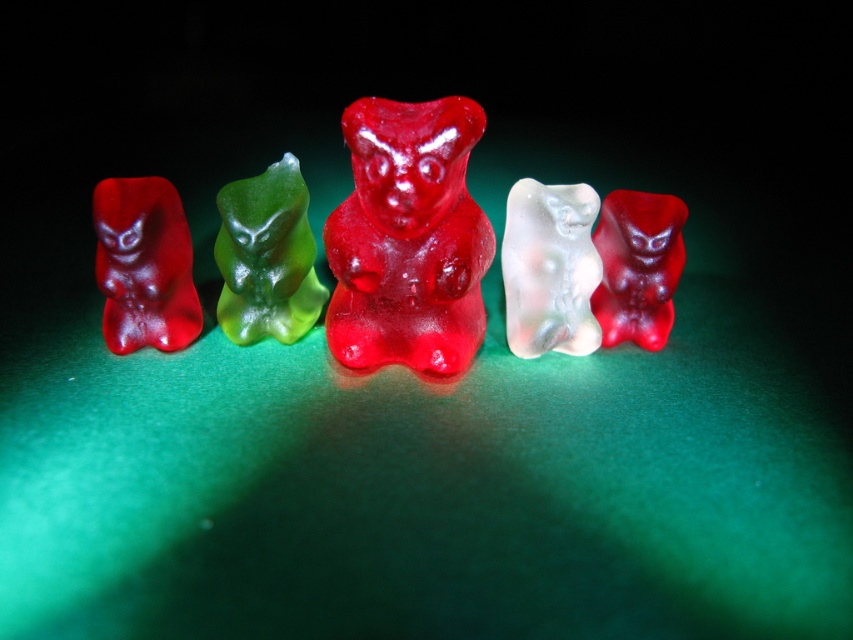
You are a child trying to reach the matte red gummy bear at left from where you are standing. The distance between you and the nearest gummy bear is 1.19 meters. Can you safely reach it without moving your feet?

The distance between you and the nearest gummy bear is 1.19 meters, which is too far to reach without moving your feet. You need to take a step forward or move closer to grab it.

You are a child trying to grab the closest gummy bear to your hand. You see the matte red gummy bear at left and the translucent white bear at center. Which one should you reach for to get the closest one?

The matte red gummy bear at left is closer to the viewer than the translucent white bear at center, so you should reach for the matte red gummy bear at left.